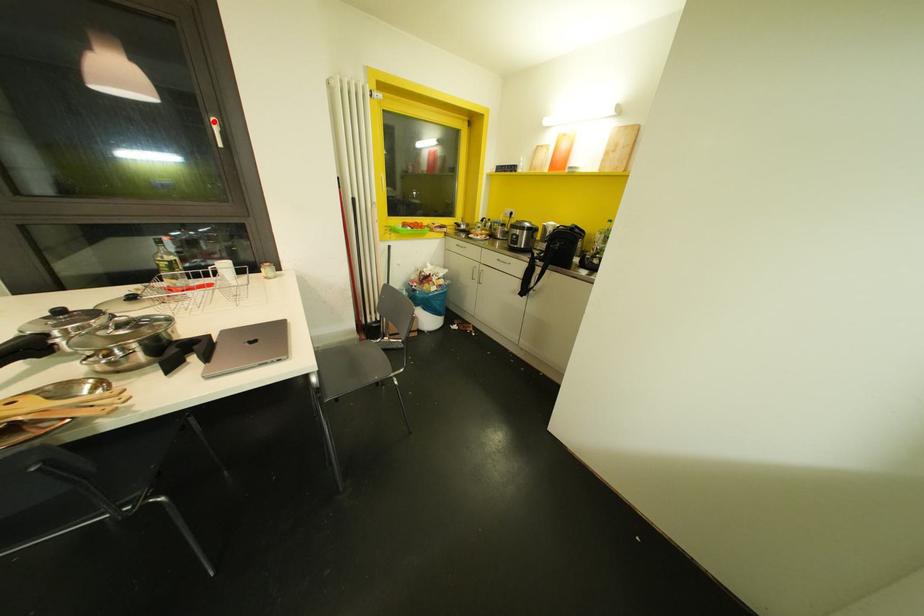
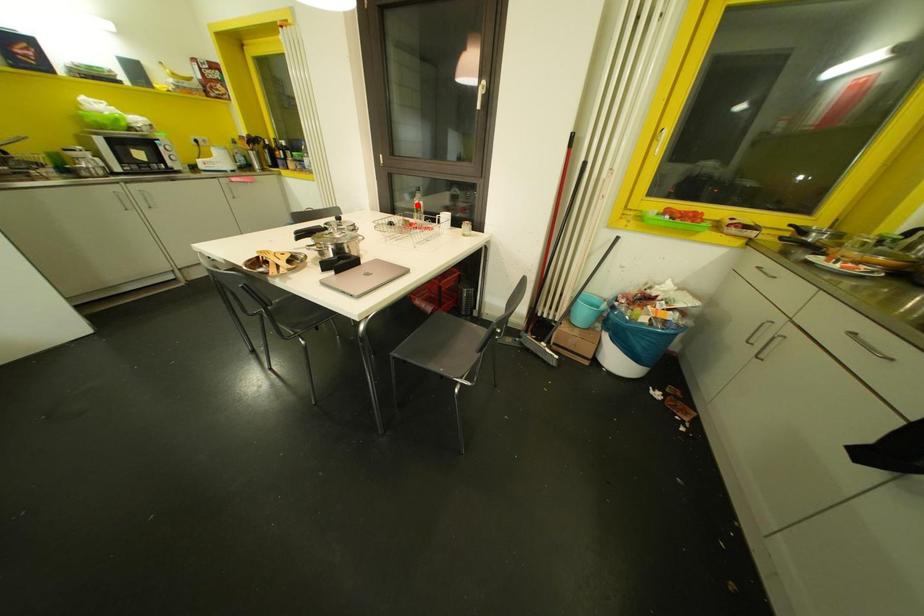
I am providing you with two images of the same scene from different viewpoints. A red point is marked on the first image and another point is marked on the second image. Is the marked point in image1 the same physical position as the marked point in image2?

No